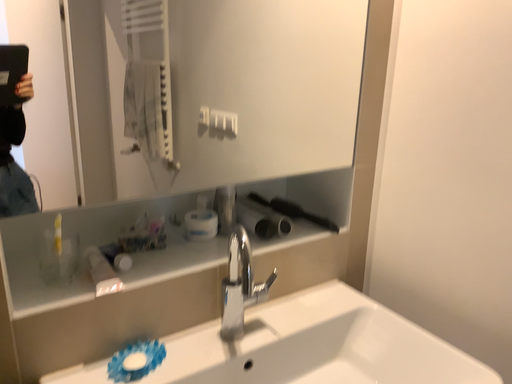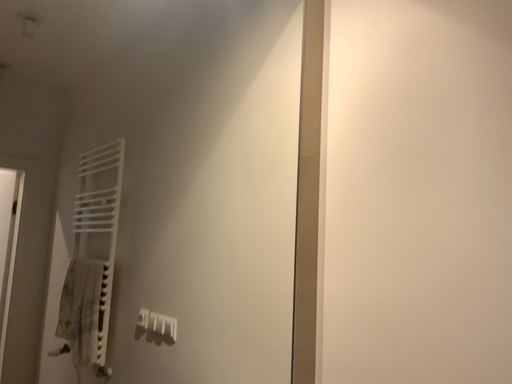
Question: How did the camera likely rotate when shooting the video?

Choices:
 (A) rotated downward
 (B) rotated upward

Answer: (B)